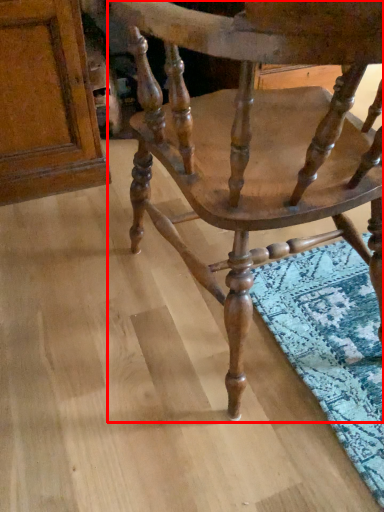
Question: From the image's perspective, where is chair (annotated by the red box) located relative to plank?

Choices:
 (A) below
 (B) above

Answer: (A)